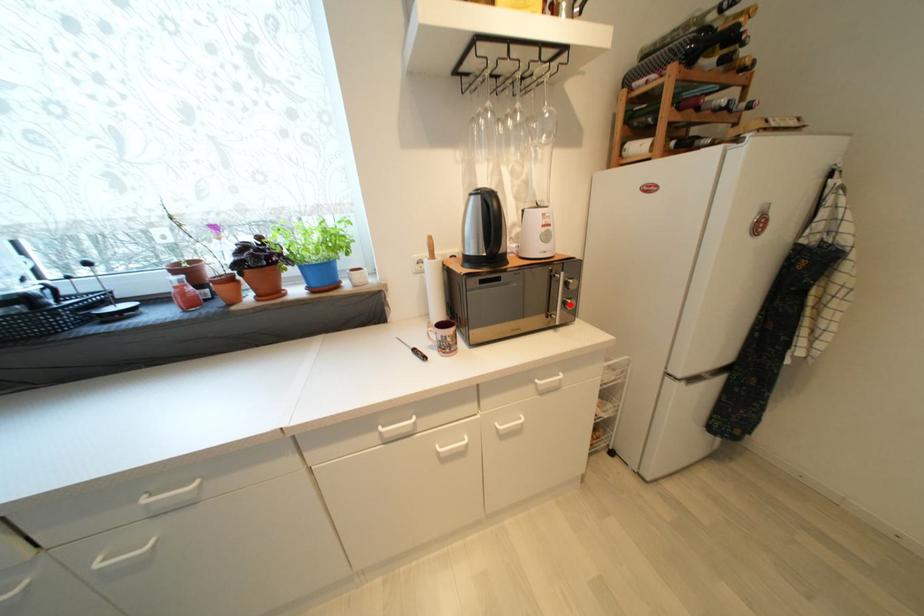
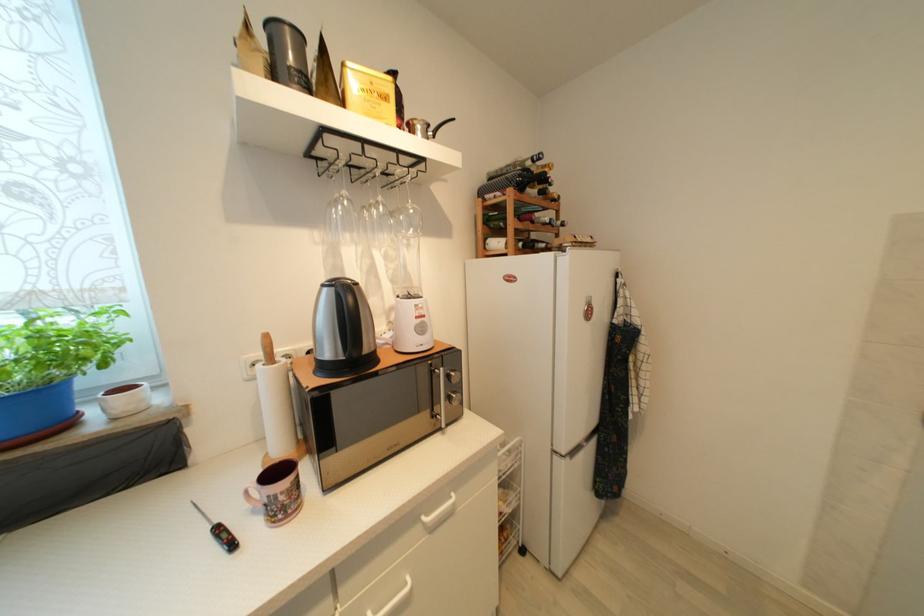
Question: I am providing you with two images of the same scene from different viewpoints. In image1, a red point is highlighted. Considering the same 3D point in image2, which of the following is correct?

Choices:
 (A) It is closer
 (B) It is farther

Answer: (B)